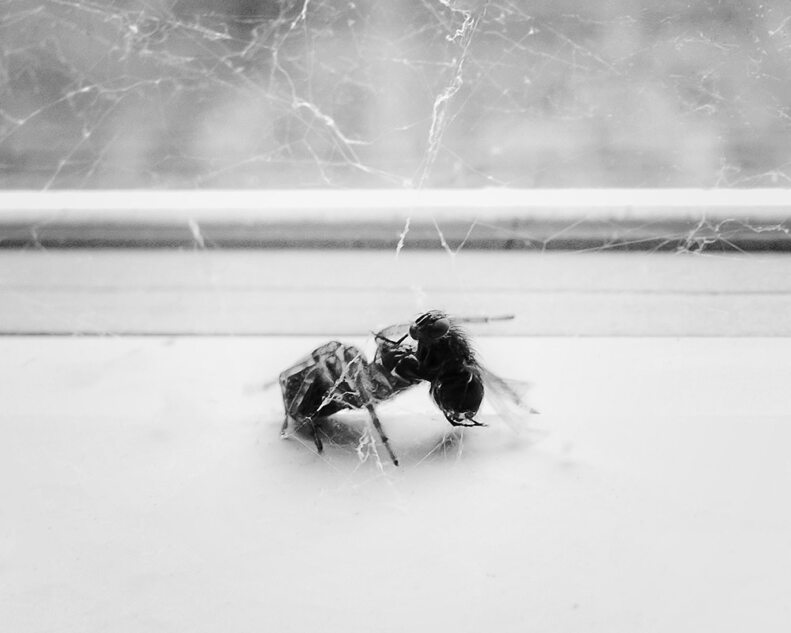
Find the location of a particular element. The image size is (791, 633). ledge is located at coordinates (334, 211).